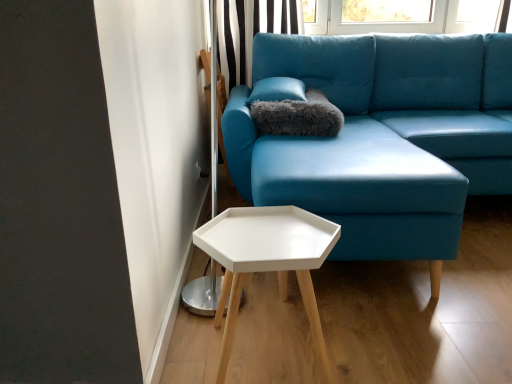
What do you see at coordinates (250, 32) in the screenshot?
I see `black striped curtain at upper center` at bounding box center [250, 32].

Locate an element on the screen. black striped curtain at upper center is located at coordinates (250, 32).

Is white matte hexagonal table at lower center positioned with its back to black striped curtain at upper center?

No, white matte hexagonal table at lower center is not facing away from black striped curtain at upper center.

Considering the sizes of objects white matte hexagonal table at lower center and black striped curtain at upper center in the image provided, who is taller, white matte hexagonal table at lower center or black striped curtain at upper center?

black striped curtain at upper center is taller.

Consider the image. From a real-world perspective, is white matte hexagonal table at lower center physically above black striped curtain at upper center?

No, from a real-world perspective, white matte hexagonal table at lower center is not above black striped curtain at upper center.

Does white matte hexagonal table at lower center touch black striped curtain at upper center?

white matte hexagonal table at lower center and black striped curtain at upper center are not in contact.

Is white matte hexagonal table at lower center surrounded by gray fluffy pillow at upper center?

No, white matte hexagonal table at lower center is not surrounded by gray fluffy pillow at upper center.

Considering the relative sizes of gray fluffy pillow at upper center and white matte hexagonal table at lower center in the image provided, is gray fluffy pillow at upper center shorter than white matte hexagonal table at lower center?

Correct, gray fluffy pillow at upper center is not as tall as white matte hexagonal table at lower center.

Identify the location of pillow above the white matte hexagonal table at lower center (from the image's perspective). This screenshot has width=512, height=384. (298, 116).

Are gray fluffy pillow at upper center and white matte hexagonal table at lower center beside each other?

No, gray fluffy pillow at upper center is not in contact with white matte hexagonal table at lower center.

How much distance is there between matte blue fabric couch at center and white matte hexagonal table at lower center?

25.66 inches.

Can you see matte blue fabric couch at center touching white matte hexagonal table at lower center?

No, matte blue fabric couch at center is not in contact with white matte hexagonal table at lower center.

Between point (500, 175) and point (260, 212), which one is positioned in front?

Point (260, 212)

Is matte blue fabric couch at center positioned with its back to white matte hexagonal table at lower center?

matte blue fabric couch at center does not have its back to white matte hexagonal table at lower center.

How different are the orientations of gray fluffy pillow at upper center and black striped curtain at upper center in degrees?

The facing directions of gray fluffy pillow at upper center and black striped curtain at upper center are 1.28 degrees apart.

Is gray fluffy pillow at upper center far away from black striped curtain at upper center?

No, there isn't a large distance between gray fluffy pillow at upper center and black striped curtain at upper center.

Considering the positions of points (278, 102) and (284, 26), is point (278, 102) farther from camera compared to point (284, 26)?

No, (278, 102) is in front of (284, 26).

Considering the relative positions of matte blue fabric couch at center and gray fluffy pillow at upper center in the image provided, is matte blue fabric couch at center to the left of gray fluffy pillow at upper center from the viewer's perspective?

No.

From a real-world perspective, which is physically below, matte blue fabric couch at center or gray fluffy pillow at upper center?

matte blue fabric couch at center, from a real-world perspective.

Do you think matte blue fabric couch at center is within gray fluffy pillow at upper center, or outside of it?

matte blue fabric couch at center lies outside gray fluffy pillow at upper center.

In terms of height, does matte blue fabric couch at center look taller or shorter compared to black striped curtain at upper center?

matte blue fabric couch at center is taller than black striped curtain at upper center.

Considering the sizes of objects matte blue fabric couch at center and black striped curtain at upper center in the image provided, who is thinner, matte blue fabric couch at center or black striped curtain at upper center?

black striped curtain at upper center is thinner.

Which is more to the left, matte blue fabric couch at center or black striped curtain at upper center?

Positioned to the left is black striped curtain at upper center.

In the scene shown: In terms of height, does white matte hexagonal table at lower center look taller or shorter compared to matte blue fabric couch at center?

Clearly, white matte hexagonal table at lower center is shorter compared to matte blue fabric couch at center.

Looking at this image, how much distance is there between white matte hexagonal table at lower center and matte blue fabric couch at center?

A distance of 25.66 inches exists between white matte hexagonal table at lower center and matte blue fabric couch at center.

Does white matte hexagonal table at lower center appear on the right side of matte blue fabric couch at center?

Incorrect, white matte hexagonal table at lower center is not on the right side of matte blue fabric couch at center.

Which point is more distant from viewer, (327, 376) or (395, 61)?

The point (395, 61) is behind.

Identify the location of curtain located above the white matte hexagonal table at lower center (from the image's perspective). This screenshot has width=512, height=384. click(x=250, y=32).

The height and width of the screenshot is (384, 512). What are the coordinates of `table located on the left of gray fluffy pillow at upper center` in the screenshot? It's located at (267, 261).

Considering their positions, is white matte hexagonal table at lower center positioned further to gray fluffy pillow at upper center than black striped curtain at upper center?

Among the two, black striped curtain at upper center is located further to gray fluffy pillow at upper center.

Looking at the image, which one is located further to matte blue fabric couch at center, black striped curtain at upper center or gray fluffy pillow at upper center?

The object further to matte blue fabric couch at center is black striped curtain at upper center.

Considering their positions, is matte blue fabric couch at center positioned closer to gray fluffy pillow at upper center than white matte hexagonal table at lower center?

matte blue fabric couch at center.

Considering their positions, is gray fluffy pillow at upper center positioned closer to black striped curtain at upper center than matte blue fabric couch at center?

matte blue fabric couch at center.

Based on their spatial positions, is matte blue fabric couch at center or black striped curtain at upper center further from white matte hexagonal table at lower center?

black striped curtain at upper center lies further to white matte hexagonal table at lower center than the other object.

From the picture: From the image, which object appears to be farther from black striped curtain at upper center, gray fluffy pillow at upper center or white matte hexagonal table at lower center?

Among the two, white matte hexagonal table at lower center is located further to black striped curtain at upper center.

From the image, which object appears to be farther from matte blue fabric couch at center, white matte hexagonal table at lower center or black striped curtain at upper center?

black striped curtain at upper center.

Based on their spatial positions, is gray fluffy pillow at upper center or white matte hexagonal table at lower center closer to matte blue fabric couch at center?

Based on the image, gray fluffy pillow at upper center appears to be nearer to matte blue fabric couch at center.

Find the location of a particular element. This screenshot has width=512, height=384. pillow positioned between white matte hexagonal table at lower center and black striped curtain at upper center from near to far is located at coordinates (298, 116).

Locate an element on the screen. The width and height of the screenshot is (512, 384). pillow between matte blue fabric couch at center and black striped curtain at upper center from front to back is located at coordinates (298, 116).

This screenshot has height=384, width=512. Identify the location of studio couch between white matte hexagonal table at lower center and black striped curtain at upper center from front to back. (381, 137).

Find the location of a particular element. This screenshot has height=384, width=512. studio couch between white matte hexagonal table at lower center and gray fluffy pillow at upper center along the z-axis is located at coordinates (381, 137).